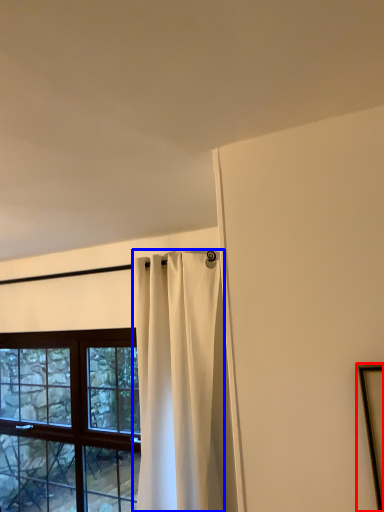
Question: Which of the following is the farthest to the observer, picture frame (highlighted by a red box) or curtain (highlighted by a blue box)?

Choices:
 (A) picture frame
 (B) curtain

Answer: (B)